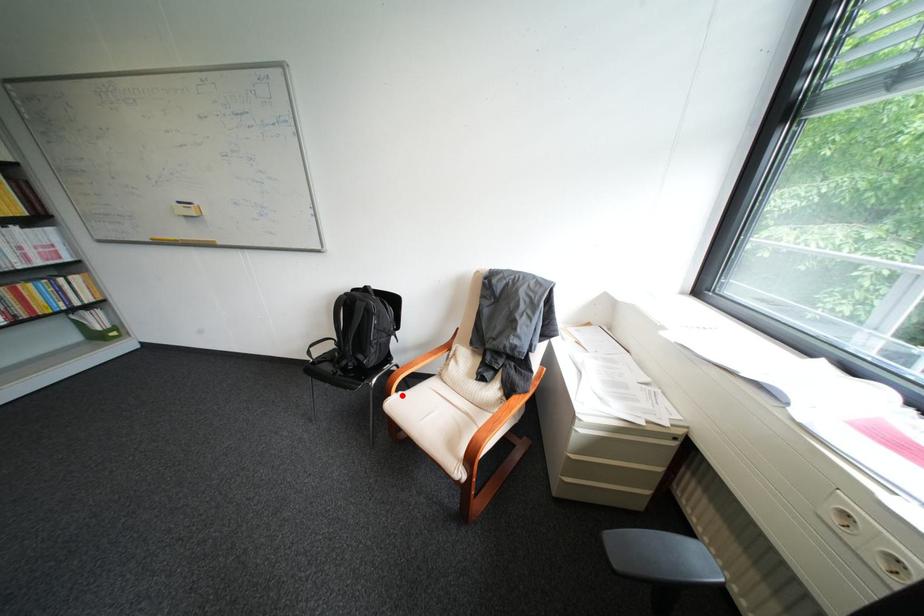
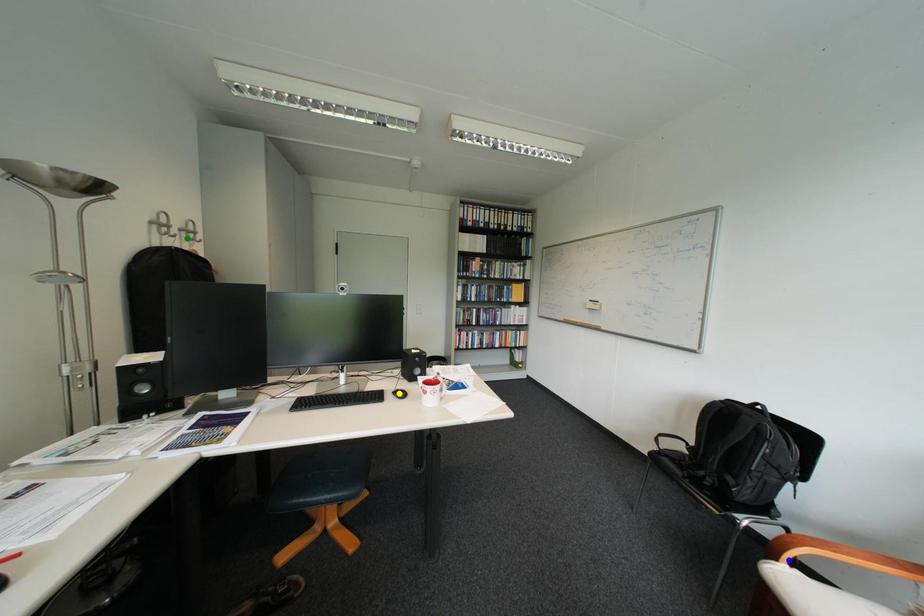
Question: I am providing you with two images of the same scene from different viewpoints. A red point is marked on the first image. You are given multiple points on the second image. Which spot in image 2 lines up with the point in image 1?

Choices:
 (A) green point
 (B) yellow point
 (C) blue point

Answer: (C)